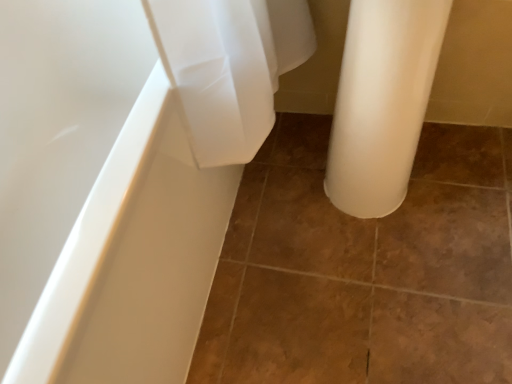
Question: Based on their positions, is matte white bathtub at left located to the left or right of brown matte tile at center?

Choices:
 (A) right
 (B) left

Answer: (B)

Question: Based on their sizes in the image, would you say matte white bathtub at left is bigger or smaller than brown matte tile at center?

Choices:
 (A) big
 (B) small

Answer: (A)

Question: Is point (57, 271) positioned closer to the camera than point (293, 254)?

Choices:
 (A) closer
 (B) farther

Answer: (A)

Question: Would you say brown matte tile at center is to the left or to the right of matte white bathtub at left in the picture?

Choices:
 (A) right
 (B) left

Answer: (A)

Question: Is brown matte tile at center spatially inside matte white bathtub at left, or outside of it?

Choices:
 (A) outside
 (B) inside

Answer: (A)

Question: Is brown matte tile at center taller or shorter than matte white bathtub at left?

Choices:
 (A) short
 (B) tall

Answer: (A)

Question: Considering the positions of brown matte tile at center and matte white bathtub at left in the image, is brown matte tile at center wider or thinner than matte white bathtub at left?

Choices:
 (A) thin
 (B) wide

Answer: (B)